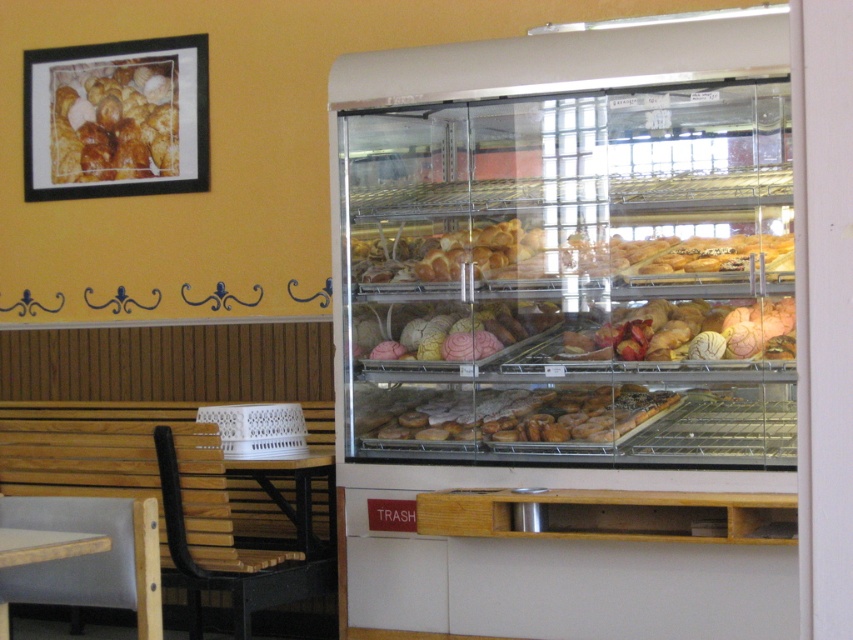
Is the position of matte white pastries at center less distant than that of matte white croissant at center?

No.

Consider the image. Can you confirm if matte white pastries at center is positioned to the left of matte white croissant at center?

No, matte white pastries at center is not to the left of matte white croissant at center.

Between point (428, 321) and point (422, 243), which one is positioned behind?

The point (422, 243) is behind.

Find the location of a particular element. This screenshot has width=853, height=640. matte white pastries at center is located at coordinates (448, 332).

Can you confirm if black framed picture at upper left is thinner than glazed doughnuts at center?

Yes.

Between black framed picture at upper left and glazed doughnuts at center, which one has less height?

glazed doughnuts at center is shorter.

Between point (50, 93) and point (454, 435), which one is positioned behind?

The point (50, 93) is more distant.

Where is `black framed picture at upper left`? black framed picture at upper left is located at coordinates (115, 118).

Where is `black framed picture at upper left`? Image resolution: width=853 pixels, height=640 pixels. black framed picture at upper left is located at coordinates (115, 118).